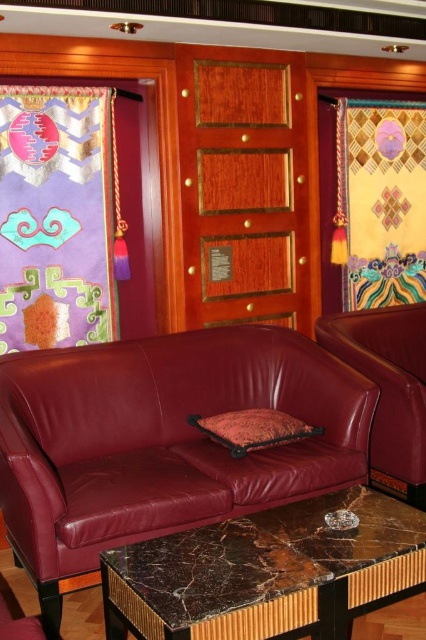
Question: Which object is farther from the camera taking this photo?

Choices:
 (A) marble/stone coffee table at center
 (B) velvet-like orange pillow at center
 (C) burgundy leather couch at center
 (D) leather at right

Answer: (D)

Question: Among these points, which one is farthest from the camera?

Choices:
 (A) (196, 376)
 (B) (276, 433)

Answer: (A)

Question: Does burgundy leather couch at center have a lesser width compared to leather at right?

Choices:
 (A) yes
 (B) no

Answer: (B)

Question: Which of the following is the closest to the observer?

Choices:
 (A) velvet-like orange pillow at center
 (B) leather at right
 (C) marble/stone coffee table at center

Answer: (C)

Question: Can you confirm if burgundy leather couch at center is smaller than marble/stone coffee table at center?

Choices:
 (A) no
 (B) yes

Answer: (A)

Question: Where is burgundy leather couch at center located in relation to marble/stone coffee table at center in the image?

Choices:
 (A) right
 (B) left

Answer: (B)